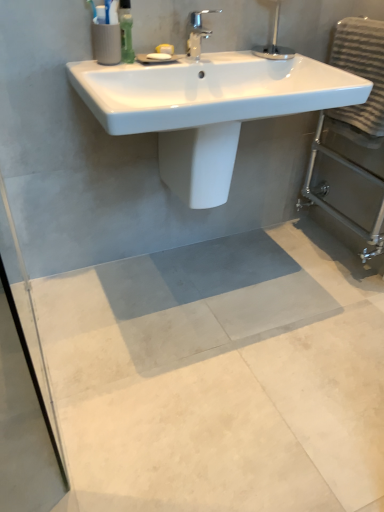
What are the coordinates of `vacant area located to the right-hand side of chrome metallic faucet at upper center` in the screenshot? It's located at (246, 54).